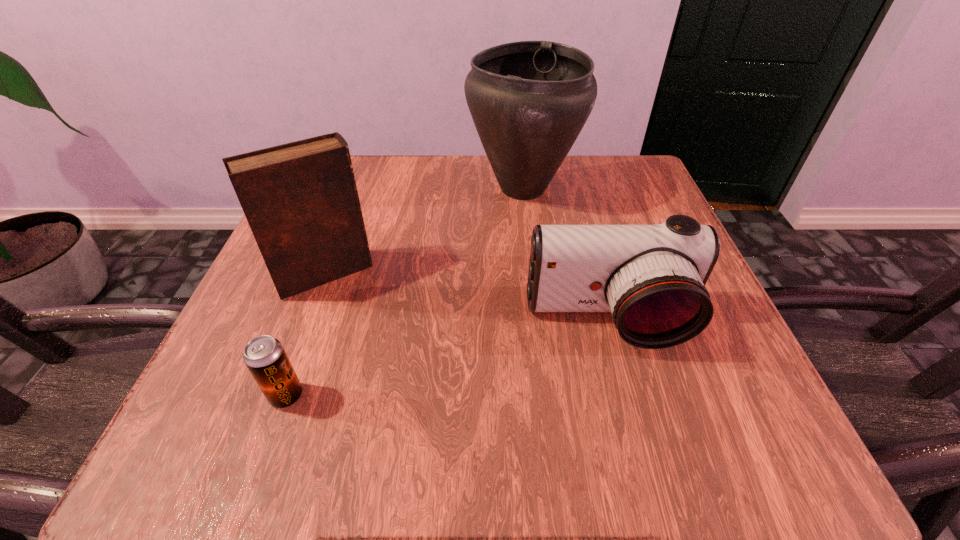
Locate an element on the screen. object that is the second closest to the shortest object is located at coordinates (652, 278).

Select which object appears as the second closest to the tallest object. Please provide its 2D coordinates. Your answer should be formatted as a tuple, i.e. [(x, y)], where the tuple contains the x and y coordinates of a point satisfying the conditions above.

[(652, 278)]

At what (x,y) coordinates should I click in order to perform the action: click on free location that satisfies the following two spatial constraints: 1. on the front side of the second tallest object; 2. on the right side of the beer can. Please return your answer as a coordinate pair (x, y). This screenshot has width=960, height=540. Looking at the image, I should click on (280, 396).